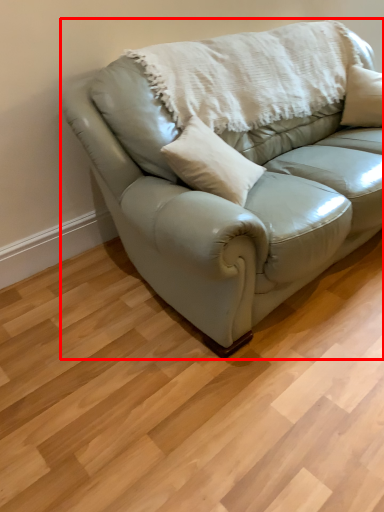
Question: Where is studio couch (annotated by the red box) located in relation to blanket in the image?

Choices:
 (A) right
 (B) left

Answer: (A)